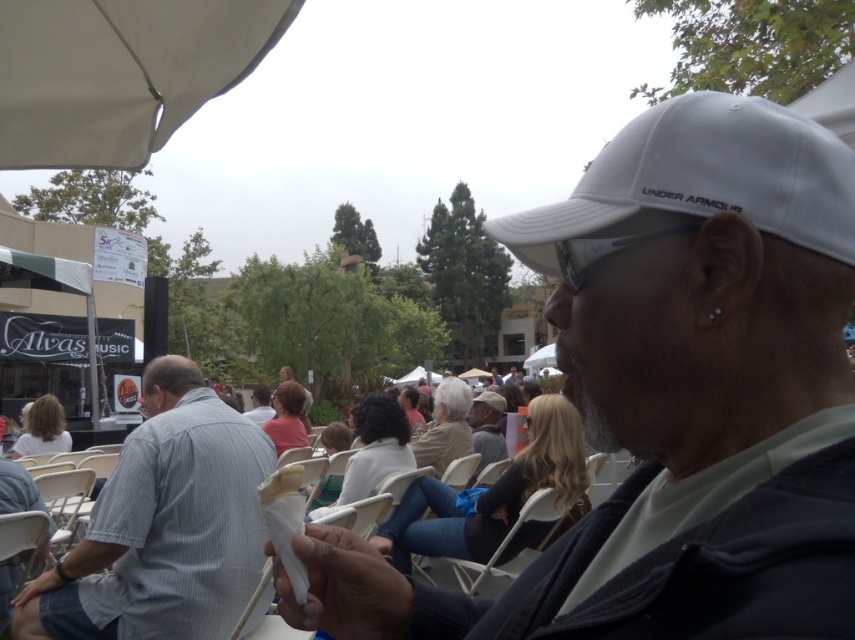
Question: Which object is the closest to the white fabric canopy at upper left?

Choices:
 (A) striped cotton shirt at center
 (B) white matte cap at upper right
 (C) white plastic chairs at center

Answer: (B)

Question: Observing the image, what is the correct spatial positioning of striped cotton shirt at center in reference to white fabric canopy at upper left?

Choices:
 (A) above
 (B) below

Answer: (B)

Question: Which object is closer to the camera taking this photo?

Choices:
 (A) striped cotton shirt at center
 (B) white matte baseball cap at upper right
 (C) white matte cap at upper right
 (D) white fabric canopy at upper left

Answer: (C)

Question: Does striped cotton shirt at center have a lesser width compared to white fabric canopy at upper left?

Choices:
 (A) yes
 (B) no

Answer: (B)

Question: Which of the following is the closest to the observer?

Choices:
 (A) white plastic chairs at center
 (B) white matte cap at upper right
 (C) white matte baseball cap at upper right

Answer: (B)

Question: Is white matte cap at upper right below white plastic chairs at center?

Choices:
 (A) no
 (B) yes

Answer: (A)